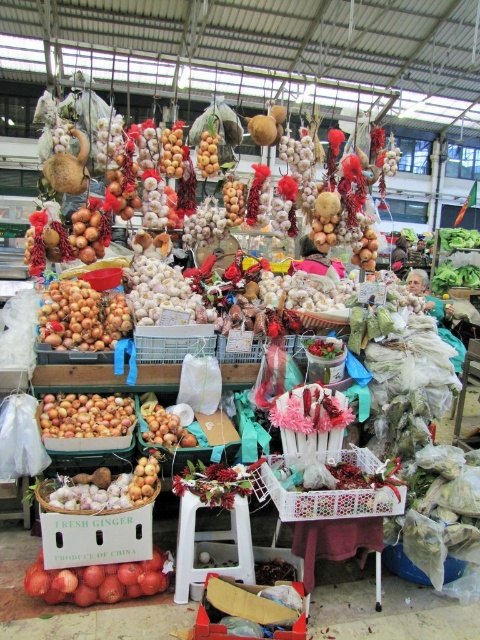
Question: Which of the following is the closest to the observer?

Choices:
 (A) smooth golden garlic at center
 (B) red glossy tomatoes at lower left
 (C) smooth brown onions at center

Answer: (B)

Question: Among these objects, which one is nearest to the camera?

Choices:
 (A) white plastic crate at center
 (B) smooth brown onions at center

Answer: (A)

Question: Is red glossy tomatoes at lower left to the left of ripe yellow apples at center from the viewer's perspective?

Choices:
 (A) no
 (B) yes

Answer: (A)

Question: Estimate the real-world distances between objects in this image. Which object is farther from the smooth golden garlic at center?

Choices:
 (A) white plastic crate at center
 (B) ripe yellow apples at center
 (C) smooth yellow onions at center
 (D) matte brown onions at center

Answer: (A)

Question: Does smooth yellow onions at center lie behind matte brown onions at center?

Choices:
 (A) yes
 (B) no

Answer: (B)

Question: Where is red glossy tomatoes at lower left located in relation to ripe yellow apples at center in the image?

Choices:
 (A) left
 (B) right

Answer: (B)